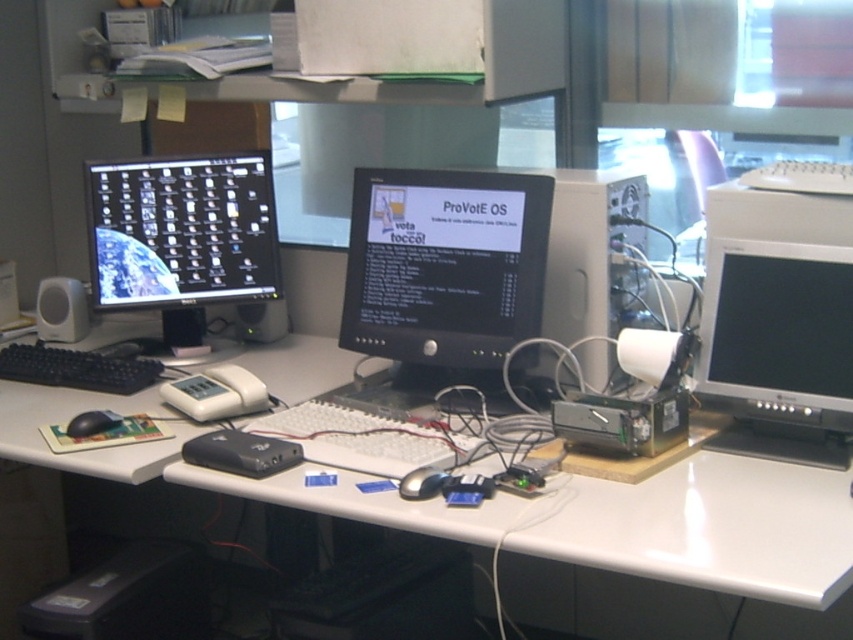
Question: Which point is closer to the camera taking this photo?

Choices:
 (A) (811, 579)
 (B) (834, 250)

Answer: (A)

Question: Among these objects, which one is farthest from the camera?

Choices:
 (A) black matte keyboard at lower left
 (B) black glossy monitor at center
 (C) matte black monitor at left
 (D) black glossy mouse at center

Answer: (C)

Question: Can you confirm if black glossy monitor at center is positioned above black matte keyboard at lower left?

Choices:
 (A) no
 (B) yes

Answer: (B)

Question: Does matte black monitor at left appear on the left side of black matte mouse at lower left?

Choices:
 (A) no
 (B) yes

Answer: (A)

Question: Considering the relative positions of matte black monitor at right and black matte keyboard at lower left in the image provided, where is matte black monitor at right located with respect to black matte keyboard at lower left?

Choices:
 (A) above
 (B) below

Answer: (A)

Question: Estimate the real-world distances between objects in this image. Which object is farther from the black matte mouse at lower left?

Choices:
 (A) matte black monitor at right
 (B) black glossy mouse at center
 (C) matte black monitor at left

Answer: (A)